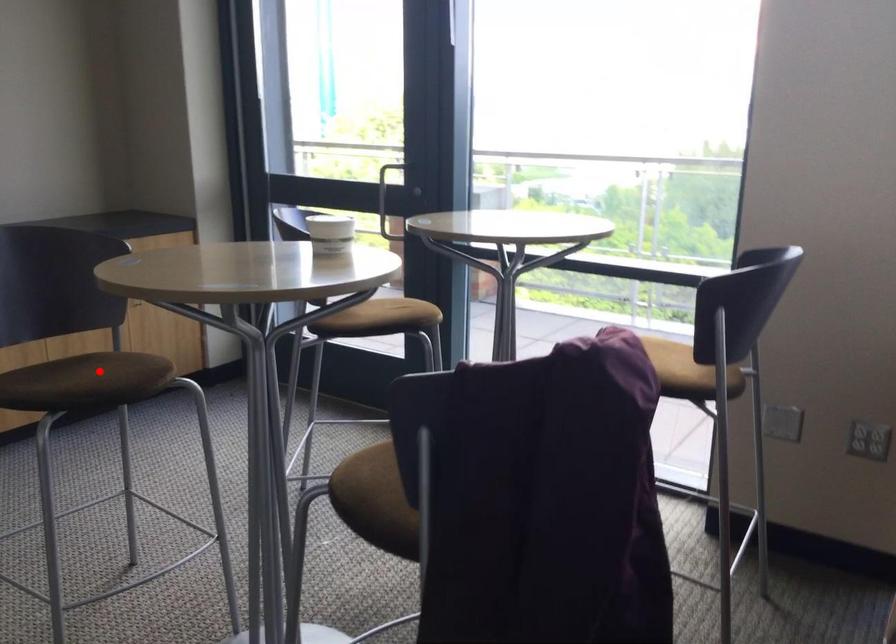
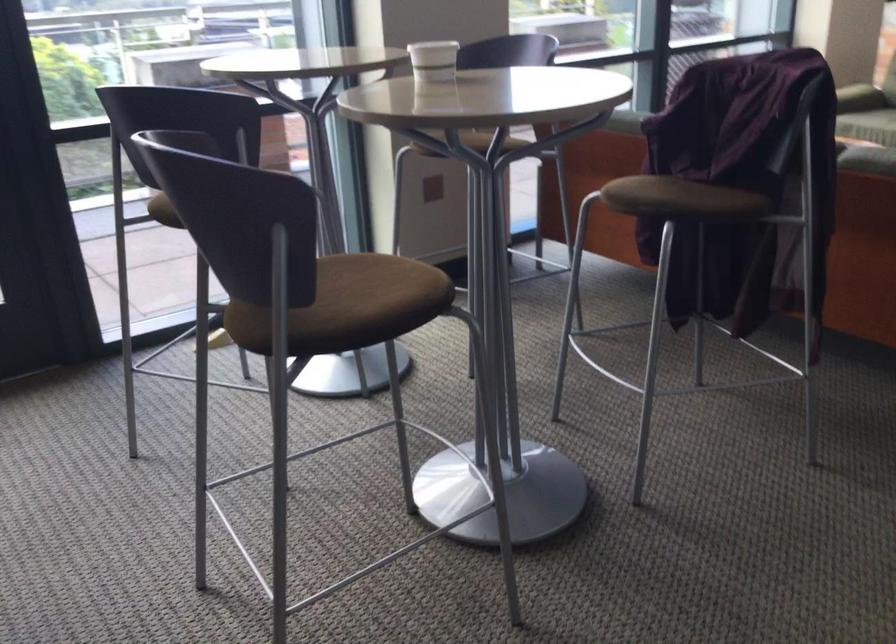
In the second image, find the point that corresponds to the highlighted location in the first image.

(371, 292)